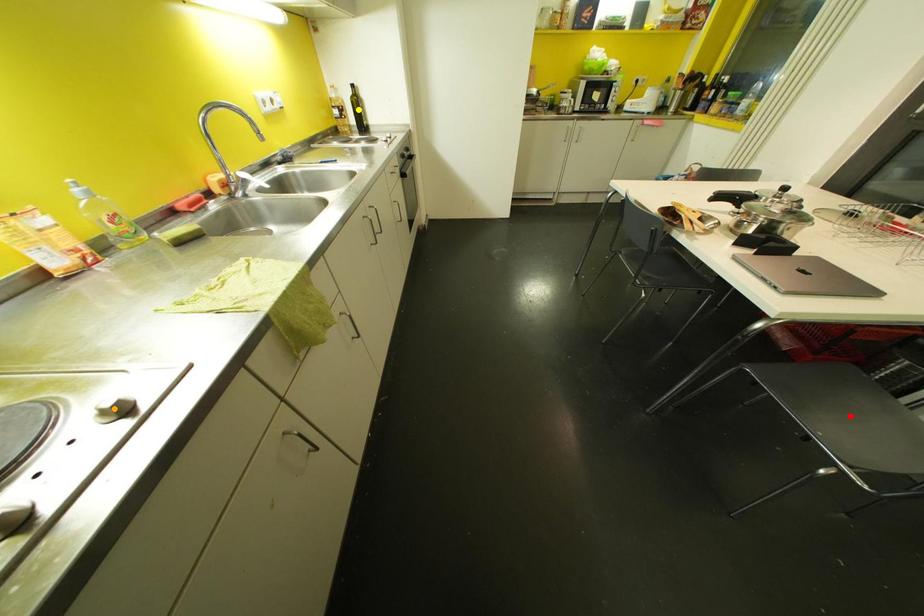
Order these from nearest to farthest:
- yellow point
- red point
- orange point

orange point < red point < yellow point